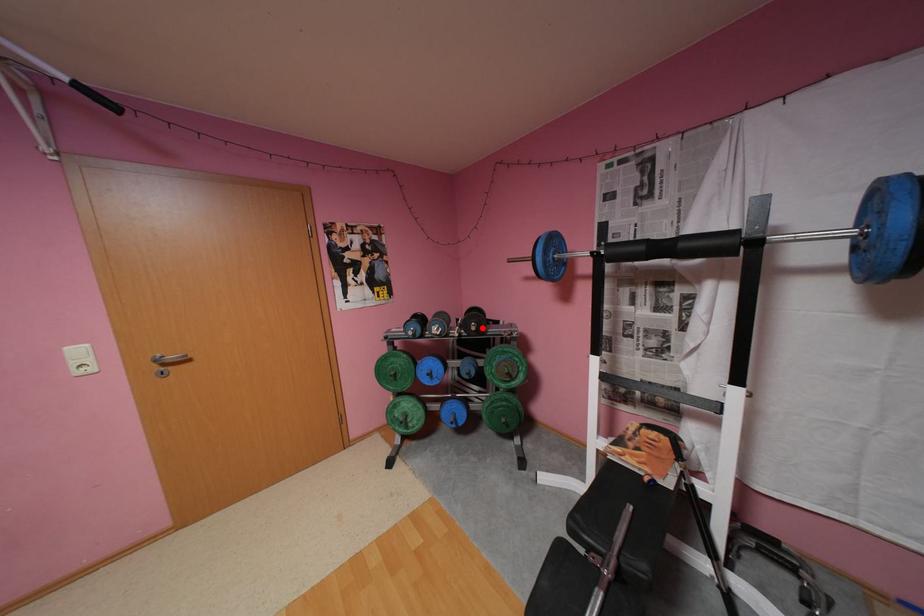
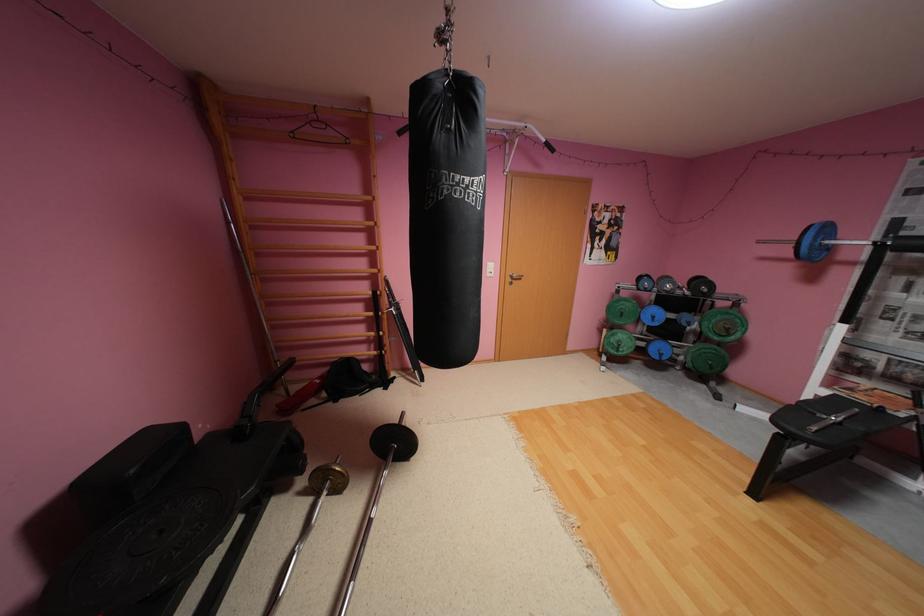
Where in the second image is the point corresponding to the highlighted location from the first image?

(714, 291)